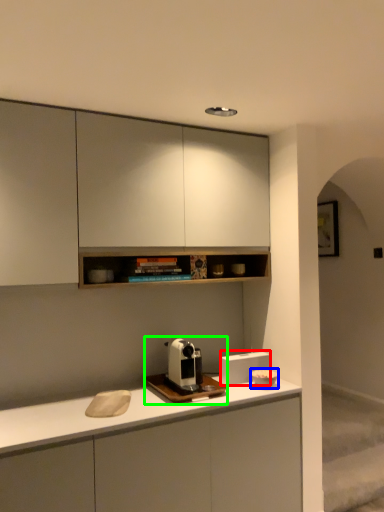
Question: Considering the real-world distances, which object is closest to appliance (highlighted by a red box)? appliance (highlighted by a blue box) or coffee machine (highlighted by a green box).

Choices:
 (A) appliance
 (B) coffee machine

Answer: (A)